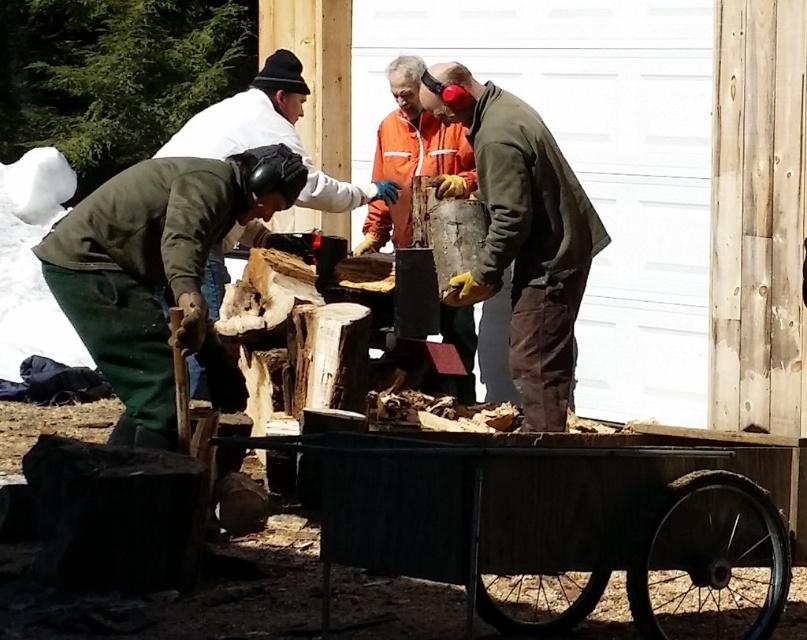
You are helping to organize tools in the workshop. You need to place the rusty metal wagon at lower center and the rusty metal bucket at center into storage. Which object should you place first if you want to store the wider item first?

A: The rusty metal wagon at lower center should be placed first since it is wider than the rusty metal bucket at center according to the description.

You are helping to organize tools at the construction site. You need to place a new tool box between the rusty metal wagon at lower center and the rusty metal bucket at center. Based on their positions, which object should the tool box be closer to?

The tool box should be placed closer to the rusty metal bucket at center because the rusty metal wagon at lower center is to the right of the rusty metal bucket at center, meaning the bucket is positioned to the left of the wagon. Therefore, placing the tool box between them would require it to be closer to the bucket to maintain the leftward position.